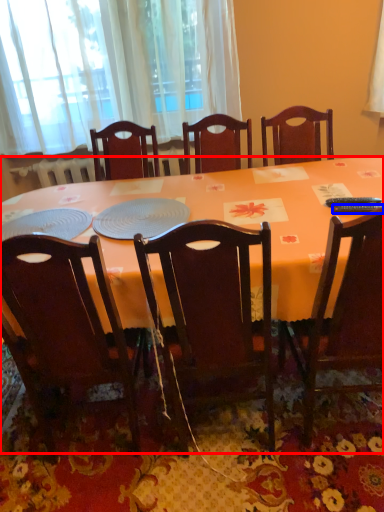
Question: Which of the following is the farthest to the observer, desk (highlighted by a red box) or remote control (highlighted by a blue box)?

Choices:
 (A) desk
 (B) remote control

Answer: (B)